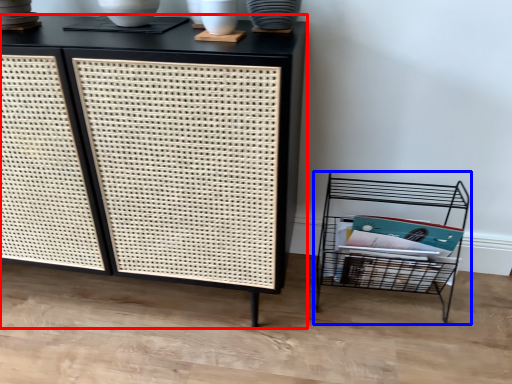
Question: Which of the following is the farthest to the observer, furniture (highlighted by a red box) or shelf (highlighted by a blue box)?

Choices:
 (A) furniture
 (B) shelf

Answer: (B)